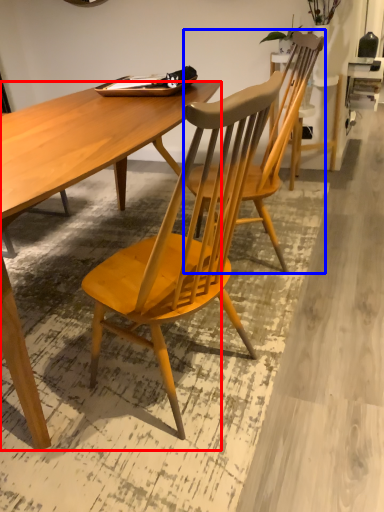
Question: Which object is closer to the camera taking this photo, desk (highlighted by a red box) or chair (highlighted by a blue box)?

Choices:
 (A) desk
 (B) chair

Answer: (A)